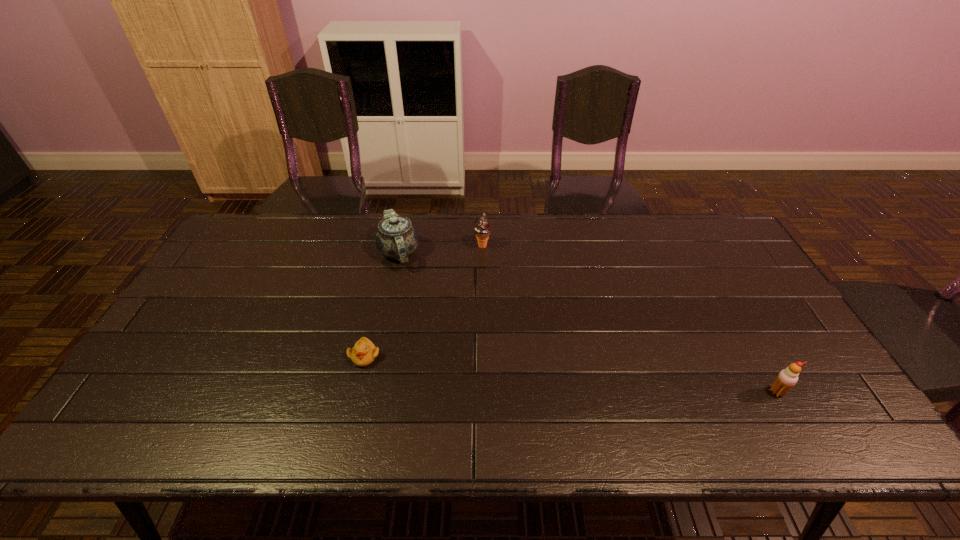
You are a GUI agent. You are given a task and a screenshot of the screen. Output one action in this format:
    pyautogui.click(x=<x>, y=<y>)
    Task: Click on the vacant space at the far right corner of the desktop
    The image size is (960, 540).
    Given the screenshot: What is the action you would take?
    pyautogui.click(x=705, y=215)

Find the location of a particular element. Image resolution: width=960 pixels, height=540 pixels. free space between the nearest object and the third farthest object is located at coordinates (570, 374).

The height and width of the screenshot is (540, 960). Identify the location of vacant space that is in between the third farthest object and the nearest object. (570, 374).

Locate an element on the screen. The height and width of the screenshot is (540, 960). empty space between the second nearest object and the left icecream is located at coordinates (423, 301).

At what (x,y) coordinates should I click in order to perform the action: click on free space between the chinaware and the third object from left to right. Please return your answer as a coordinate pair (x, y). This screenshot has height=540, width=960. Looking at the image, I should click on coord(441,249).

Locate an element on the screen. This screenshot has height=540, width=960. free space between the nearest object and the duckling is located at coordinates (570, 374).

Where is `free area in between the farther icecream and the duckling`? The width and height of the screenshot is (960, 540). free area in between the farther icecream and the duckling is located at coordinates (423, 301).

The height and width of the screenshot is (540, 960). In order to click on vacant space in between the chinaware and the nearer icecream in this screenshot , I will do pos(588,322).

Where is `vacant space in between the shortest object and the chinaware`? The image size is (960, 540). vacant space in between the shortest object and the chinaware is located at coordinates (381, 305).

This screenshot has width=960, height=540. In order to click on vacant space in between the left icecream and the shortest object in this screenshot , I will do `click(423, 301)`.